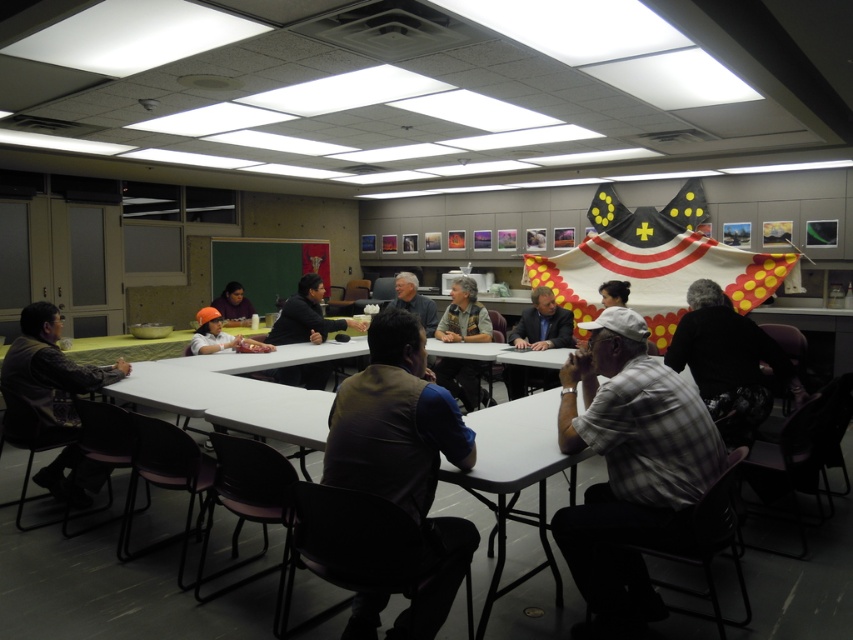
You are organizing a photo shoot in the conference room and need to position two models wearing the matte gray shirt at center and the matte black shirt at center. Based on their clothing colors, which model should stand closer to the green chalkboard to create a better contrast with the background?

The matte gray shirt at center should stand closer to the green chalkboard because it has a lighter color compared to the matte black shirt at center, creating better contrast with the green background.

You are a photographer standing at the back of the room and want to take a photo that includes both the plaid shirt at center and the camouflage vest at center. The camera you are using has a maximum zoom range that can capture objects up to 2 meters apart. Will you be able to fit both subjects into the frame without moving closer?

The distance between the plaid shirt at center and the camouflage vest at center is 2.09 meters. Since the camera can only capture up to 2 meters apart, you will not be able to fit both subjects into the frame without moving closer.

You are standing in the conference room and see two points marked on the wall. The first point is at coordinates point (519, 365) and the second is at point (421, 308). Which point is closer to you?

Point (519, 365) is closer to the camera than point (421, 308), so the first point is closer to you.